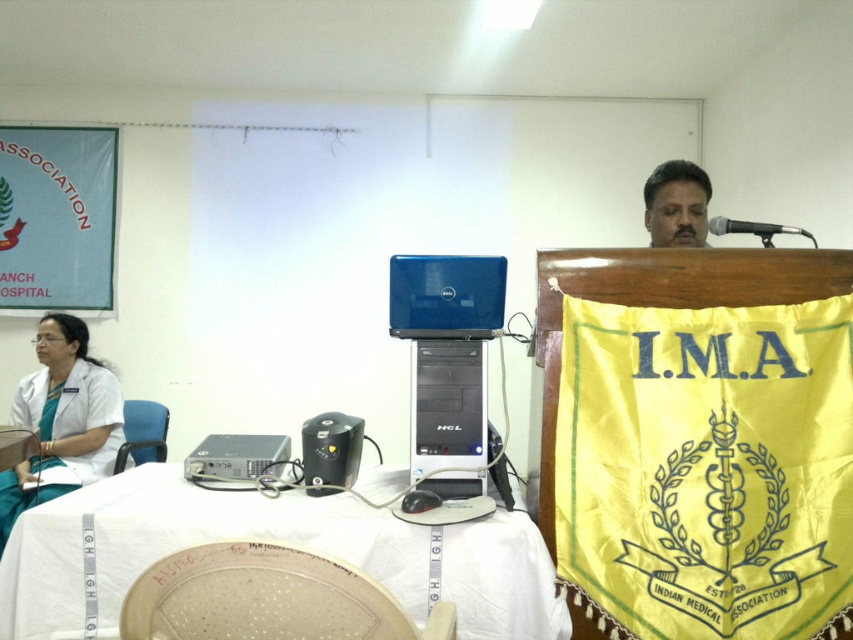
Based on the scene description, where is the white plastic table at center located in terms of coordinates?

The white plastic table at center is located at coordinates (265,540).

You are organizing an event and need to place a large poster on the wall. The poster requires a support that can hold heavy items. Which object from the scene would be more suitable for this task, the black plastic speaker at center or the metallic at upper right?

The metallic at upper right is more suitable because it is larger and likely sturdier than the black plastic speaker at center.